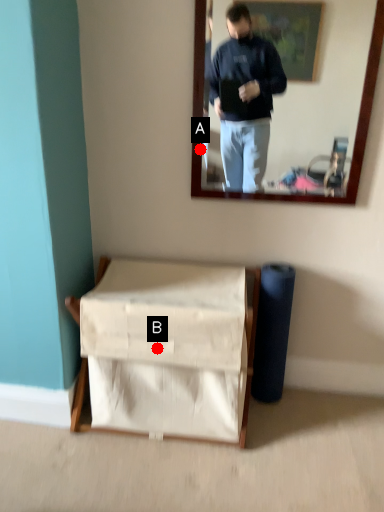
Question: Two points are circled on the image, labeled by A and B beside each circle. Which point is closer to the camera?

Choices:
 (A) A is closer
 (B) B is closer

Answer: (B)